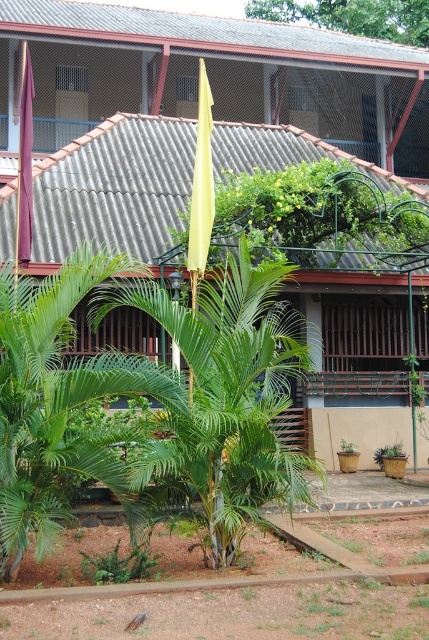
You are standing at the point labeled as point (63, 280) in a tropical setting with a building and palm trees. You want to walk directly towards the viewer. How far will you have to walk to reach the viewer?

The distance between point (63, 280) and the viewer is 23.83 feet, so you will have to walk 23.83 feet to reach the viewer.

You are a gardener who needs to water the green leafy palm tree at center and the green matte planter at lower center. Which object should you water first if you want to reach the one closer to the ground first?

You should water the green matte planter at lower center first because it is positioned lower than the green leafy palm tree at center, which is above it.

Based on the photo, you are a visitor at this tropical location and want to find the tallest palm tree between the green leafy palm at center and the green leafy palm tree at center. Which one should you look for?

The green leafy palm at center is taller than the green leafy palm tree at center, so you should look for the green leafy palm at center.